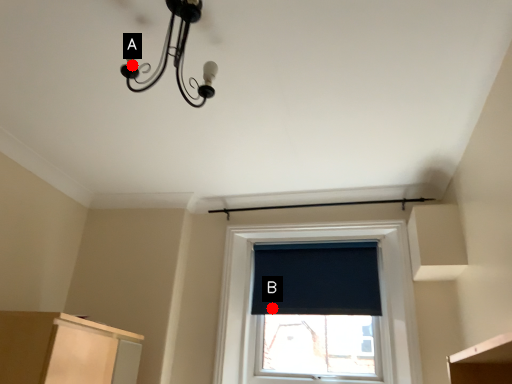
Question: Two points are circled on the image, labeled by A and B beside each circle. Which point is farther from the camera taking this photo?

Choices:
 (A) A is further
 (B) B is further

Answer: (B)